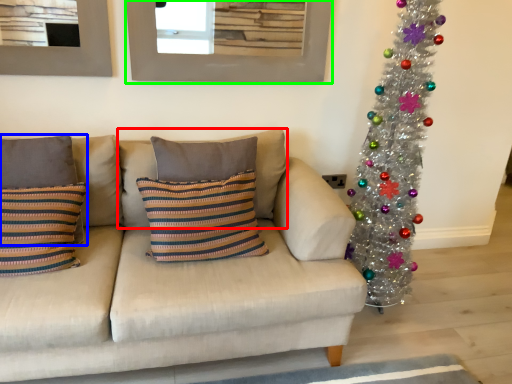
Question: Which object is the farthest from pillow (highlighted by a red box)? Choose among these: pillow (highlighted by a blue box) or picture frame (highlighted by a green box).

Choices:
 (A) pillow
 (B) picture frame

Answer: (B)